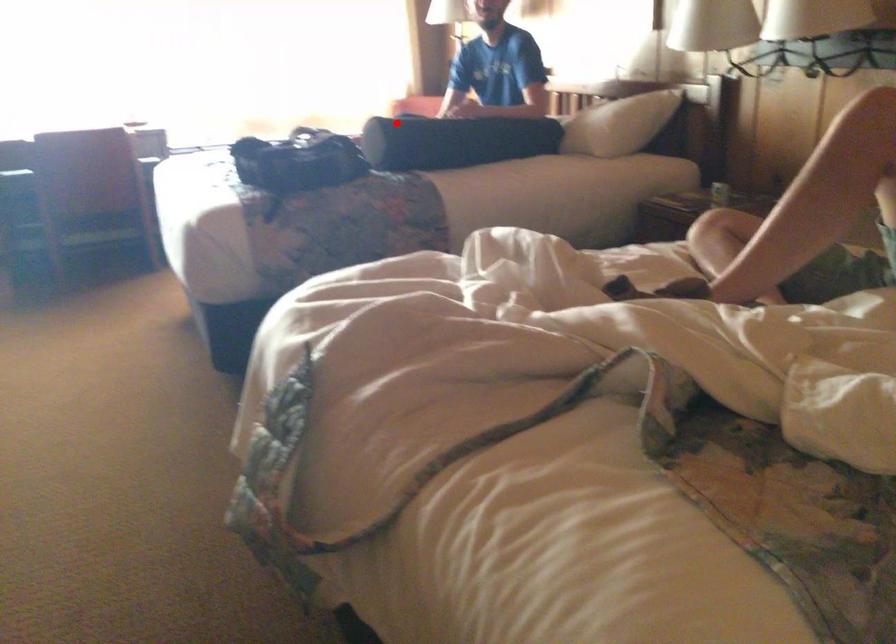
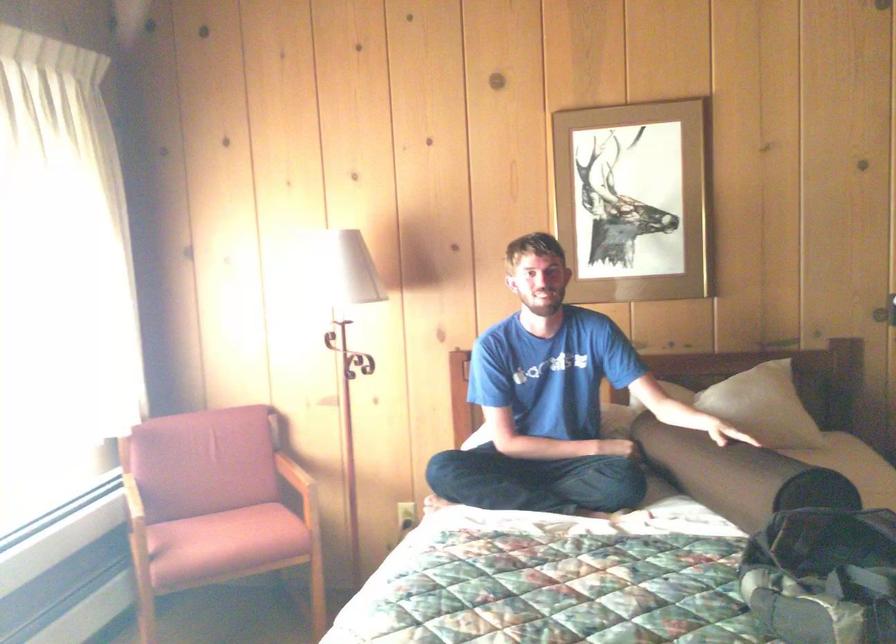
In the second image, find the point that corresponds to the highlighted location in the first image.

(737, 475)